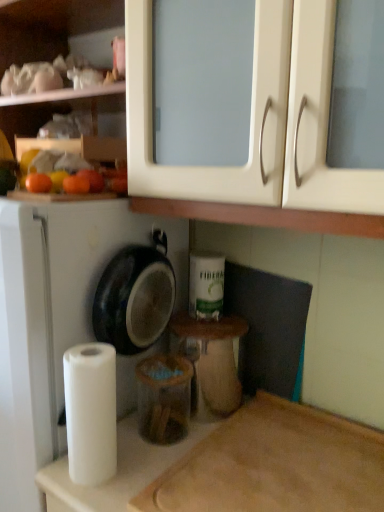
What do you see at coordinates (49, 25) in the screenshot? I see `matte white cabinet at upper center` at bounding box center [49, 25].

What do you see at coordinates (91, 412) in the screenshot? This screenshot has width=384, height=512. I see `white matte paper towel at lower left` at bounding box center [91, 412].

What do you see at coordinates (206, 285) in the screenshot? I see `white matte toilet paper at center` at bounding box center [206, 285].

The height and width of the screenshot is (512, 384). I want to click on wooden cutting board at lower right, so click(x=239, y=466).

This screenshot has width=384, height=512. Describe the element at coordinates (55, 318) in the screenshot. I see `white matte dish washer at left` at that location.

The width and height of the screenshot is (384, 512). In order to click on orange matte at left, arranged as the first orange when viewed from the right in this screenshot , I will do `click(76, 184)`.

Identify the location of matte white cabinet at upper center. (49, 25).

Is orange matte at left, which ranks as the second orange in left-to-right order, next to orange matte at left, the first orange when ordered from left to right?

Yes, orange matte at left, which ranks as the second orange in left-to-right order, is beside orange matte at left, the first orange when ordered from left to right.

Between orange matte at left, which ranks as the second orange in left-to-right order, and orange matte at left, the first orange when ordered from left to right, which one has less height?

With less height is orange matte at left, the first orange when ordered from left to right.

The width and height of the screenshot is (384, 512). I want to click on orange behind the orange matte at left, the first orange when ordered from left to right, so click(x=76, y=184).

Considering the sizes of white matte paper towel at lower left and wooden cutting board at lower right in the image, is white matte paper towel at lower left taller or shorter than wooden cutting board at lower right?

Considering their sizes, white matte paper towel at lower left has more height than wooden cutting board at lower right.

How many degrees apart are the facing directions of white matte paper towel at lower left and wooden cutting board at lower right?

There is a 1.23-degree angle between the facing directions of white matte paper towel at lower left and wooden cutting board at lower right.

From a real-world perspective, relative to wooden cutting board at lower right, is white matte paper towel at lower left vertically above or below?

white matte paper towel at lower left is above wooden cutting board at lower right.

Which is more to the left, white matte paper towel at lower left or wooden cutting board at lower right?

From the viewer's perspective, white matte paper towel at lower left appears more on the left side.

Is white matte toilet paper at center outside of white matte paper towel at lower left?

Yes, white matte toilet paper at center is outside of white matte paper towel at lower left.

Which object is further away from the camera, white matte toilet paper at center or white matte paper towel at lower left?

white matte toilet paper at center is further away from the camera.

Is orange matte at left, positioned as the second orange in right-to-left order, not near matte white cabinet at upper center?

No, there isn't a large distance between orange matte at left, positioned as the second orange in right-to-left order, and matte white cabinet at upper center.

Considering the relative sizes of orange matte at left, the first orange when ordered from left to right, and matte white cabinet at upper center in the image provided, is orange matte at left, the first orange when ordered from left to right, smaller than matte white cabinet at upper center?

Correct, orange matte at left, the first orange when ordered from left to right, occupies less space than matte white cabinet at upper center.

What's the angular difference between orange matte at left, positioned as the second orange in right-to-left order, and matte white cabinet at upper center's facing directions?

orange matte at left, positioned as the second orange in right-to-left order, and matte white cabinet at upper center are facing 88.4 degrees away from each other.

Does point (41, 176) lie behind point (35, 8)?

No, it is not.

Is point (31, 402) closer or farther from the camera than point (28, 181)?

Point (31, 402).

Who is smaller, white matte dish washer at left or orange matte at left, positioned as the second orange in right-to-left order?

Smaller between the two is orange matte at left, positioned as the second orange in right-to-left order.

Measure the distance from white matte dish washer at left to orange matte at left, the first orange when ordered from left to right.

white matte dish washer at left and orange matte at left, the first orange when ordered from left to right, are 13.28 inches apart from each other.

Does white matte dish washer at left have a greater height compared to orange matte at left, positioned as the second orange in right-to-left order?

Correct, white matte dish washer at left is much taller as orange matte at left, positioned as the second orange in right-to-left order.

Is orange matte at left, the first orange when ordered from left to right, completely or partially outside of matte plastic container at center?

That's correct, orange matte at left, the first orange when ordered from left to right, is outside of matte plastic container at center.

Is orange matte at left, the first orange when ordered from left to right, facing away from matte plastic container at center?

No, matte plastic container at center is not at the back of orange matte at left, the first orange when ordered from left to right.

Considering the positions of objects orange matte at left, the first orange when ordered from left to right, and matte plastic container at center in the image provided, who is behind, orange matte at left, the first orange when ordered from left to right, or matte plastic container at center?

matte plastic container at center.

From the image's perspective, which one is positioned higher, orange matte at left, the first orange when ordered from left to right, or matte plastic container at center?

orange matte at left, the first orange when ordered from left to right, appears higher in the image.

Could you measure the distance between orange matte at left, arranged as the first orange when viewed from the right, and matte white cabinet at upper center?

51.96 centimeters.

Which object is wider, orange matte at left, arranged as the first orange when viewed from the right, or matte white cabinet at upper center?

matte white cabinet at upper center.

Is orange matte at left, arranged as the first orange when viewed from the right, looking in the opposite direction of matte white cabinet at upper center?

No, orange matte at left, arranged as the first orange when viewed from the right, is not facing the opposite direction of matte white cabinet at upper center.

Does orange matte at left, arranged as the first orange when viewed from the right, have a smaller size compared to matte white cabinet at upper center?

Indeed, orange matte at left, arranged as the first orange when viewed from the right, has a smaller size compared to matte white cabinet at upper center.

Identify the location of orange that is above the orange matte at left, the first orange when ordered from left to right (from the image's perspective). This screenshot has height=512, width=384. (76, 184).

This screenshot has width=384, height=512. What are the coordinates of `paper towel behind the wooden cutting board at lower right` in the screenshot? It's located at (91, 412).

When comparing their distances from matte plastic container at center, does white matte dish washer at left or white matte toilet paper at center seem further?

Among the two, white matte dish washer at left is located further to matte plastic container at center.

Based on their spatial positions, is white matte toilet paper at center or matte white cabinet at upper center closer to white matte dish washer at left?

Among the two, white matte toilet paper at center is located nearer to white matte dish washer at left.

Estimate the real-world distances between objects in this image. Which object is closer to white matte toilet paper at center, orange matte at left, the first orange when ordered from left to right, or matte plastic container at center?

Based on the image, matte plastic container at center appears to be nearer to white matte toilet paper at center.

From the picture: Which object lies further to the anchor point matte white cabinet at upper center, matte plastic container at center or white matte paper towel at lower left?

The object further to matte white cabinet at upper center is white matte paper towel at lower left.

Looking at the image, which one is located closer to white matte paper towel at lower left, white matte toilet paper at center or matte plastic container at center?

matte plastic container at center lies closer to white matte paper towel at lower left than the other object.

Based on their spatial positions, is matte plastic container at center or orange matte at left, the first orange when ordered from left to right, further from white matte paper towel at lower left?

orange matte at left, the first orange when ordered from left to right, is further to white matte paper towel at lower left.

Considering their positions, is white matte dish washer at left positioned further to orange matte at left, arranged as the first orange when viewed from the right, than orange matte at left, positioned as the second orange in right-to-left order?

white matte dish washer at left is further to orange matte at left, arranged as the first orange when viewed from the right.

Based on their spatial positions, is wooden cutting board at lower right or white matte paper towel at lower left further from orange matte at left, positioned as the second orange in right-to-left order?

Among the two, wooden cutting board at lower right is located further to orange matte at left, positioned as the second orange in right-to-left order.

This screenshot has height=512, width=384. Identify the location of toilet paper between matte white cabinet at upper center and white matte dish washer at left from top to bottom. coord(206,285).

You are a GUI agent. You are given a task and a screenshot of the screen. Output one action in this format:
    pyautogui.click(x=<x>, y=<y>)
    Task: Click on the dish washer between orange matte at left, arranged as the first orange when viewed from the right, and wooden cutting board at lower right, in the vertical direction
    Image resolution: width=384 pixels, height=512 pixels.
    Given the screenshot: What is the action you would take?
    pyautogui.click(x=55, y=318)

What are the coordinates of `orange that lies between orange matte at left, arranged as the first orange when viewed from the right, and wooden cutting board at lower right from top to bottom` in the screenshot? It's located at (38, 183).

Locate an element on the screen. The image size is (384, 512). orange between orange matte at left, arranged as the first orange when viewed from the right, and white matte dish washer at left vertically is located at coordinates (38, 183).